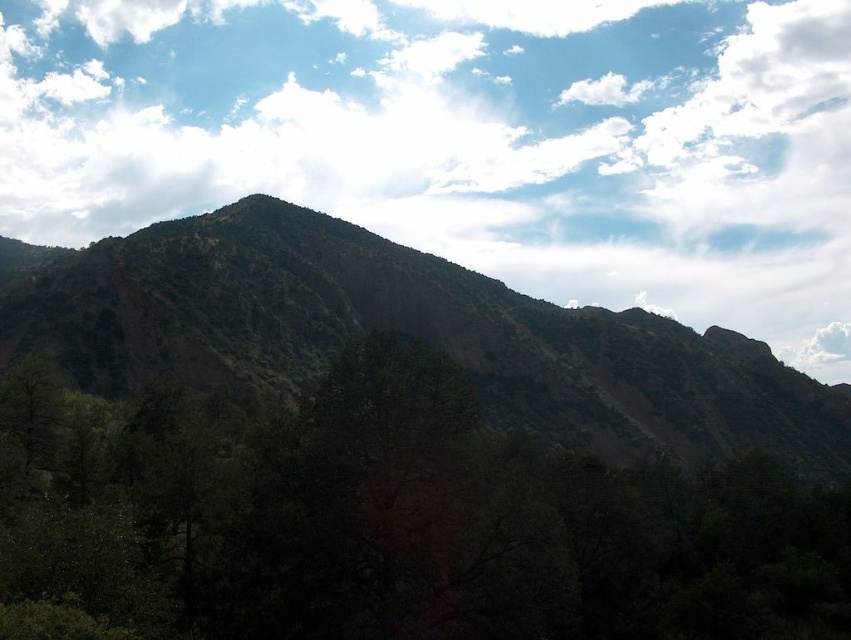
In the scene shown: Does white fluffy cloud at upper center have a smaller size compared to green textured hillside at center?

No.

Find the location of `white fluffy cloud at upper center`. white fluffy cloud at upper center is located at coordinates (467, 140).

At what (x,y) coordinates should I click in order to perform the action: click on white fluffy cloud at upper center. Please return your answer as a coordinate pair (x, y). Image resolution: width=851 pixels, height=640 pixels. Looking at the image, I should click on (467, 140).

Is point (64, 221) positioned in front of point (646, 582)?

No, it is behind (646, 582).

In the scene shown: Is white fluffy cloud at upper center smaller than green leafy tree at center?

No.

Between point (94, 237) and point (389, 486), which one is positioned behind?

The point (94, 237) is more distant.

Where is `white fluffy cloud at upper center`? white fluffy cloud at upper center is located at coordinates (467, 140).

Between green leafy tree at center and green textured hillside at center, which one appears on the right side from the viewer's perspective?

Positioned to the right is green textured hillside at center.

In order to click on green leafy tree at center in this screenshot , I will do `click(387, 522)`.